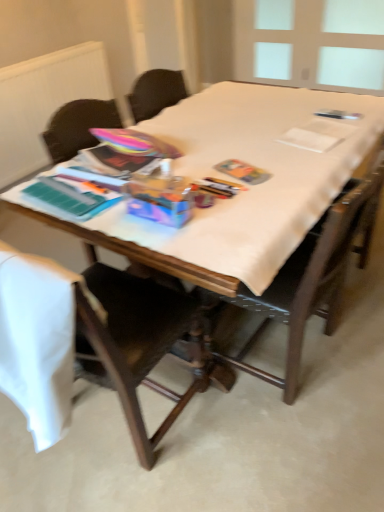
Find the location of `empty space that is ontop of wooden table at center (from a real-world perspective)`. empty space that is ontop of wooden table at center (from a real-world perspective) is located at coordinates 253,138.